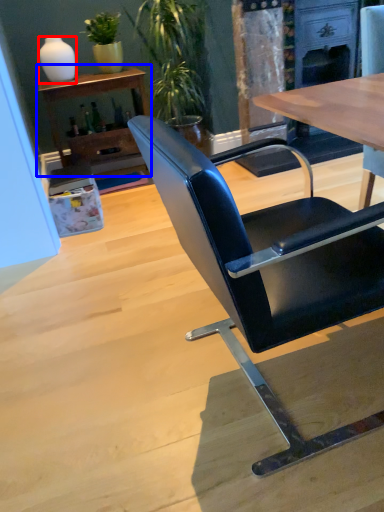
Question: Which point is further to the camera, vase (highlighted by a red box) or shelf (highlighted by a blue box)?

Choices:
 (A) vase
 (B) shelf

Answer: (A)